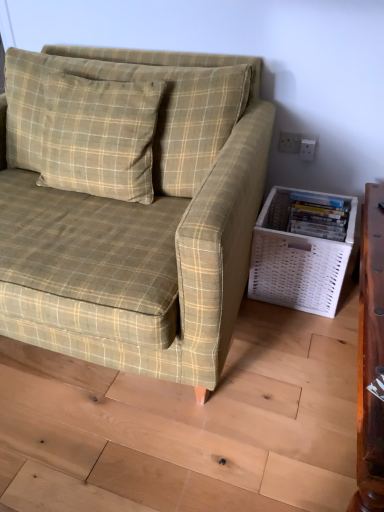
Question: Considering the relative sizes of white plastic electric outlet at upper right and green plaid pillow at upper left in the image provided, is white plastic electric outlet at upper right thinner than green plaid pillow at upper left?

Choices:
 (A) yes
 (B) no

Answer: (A)

Question: From a real-world perspective, does white plastic electric outlet at upper right stand above green plaid pillow at upper left?

Choices:
 (A) no
 (B) yes

Answer: (A)

Question: Is white plastic electric outlet at upper right to the right of green plaid pillow at upper left from the viewer's perspective?

Choices:
 (A) yes
 (B) no

Answer: (A)

Question: Is white plastic electric outlet at upper right positioned with its back to green plaid pillow at upper left?

Choices:
 (A) no
 (B) yes

Answer: (A)

Question: From a real-world perspective, does white plastic electric outlet at upper right sit lower than green plaid pillow at upper left?

Choices:
 (A) yes
 (B) no

Answer: (A)

Question: Considering the positions of white woven basket at lower right and green plaid pillow at upper left in the image, is white woven basket at lower right wider or thinner than green plaid pillow at upper left?

Choices:
 (A) wide
 (B) thin

Answer: (A)

Question: Is white woven basket at lower right situated inside green plaid pillow at upper left or outside?

Choices:
 (A) inside
 (B) outside

Answer: (B)

Question: From the image's perspective, is white woven basket at lower right positioned above or below green plaid pillow at upper left?

Choices:
 (A) above
 (B) below

Answer: (B)

Question: Considering the positions of point (324, 301) and point (140, 176), is point (324, 301) closer or farther from the camera than point (140, 176)?

Choices:
 (A) closer
 (B) farther

Answer: (B)

Question: Is white plastic electric outlet at upper right in front of or behind white woven basket at lower right in the image?

Choices:
 (A) front
 (B) behind

Answer: (B)

Question: Would you say white plastic electric outlet at upper right is inside or outside white woven basket at lower right?

Choices:
 (A) outside
 (B) inside

Answer: (A)

Question: Considering the positions of white plastic electric outlet at upper right and white woven basket at lower right in the image, is white plastic electric outlet at upper right taller or shorter than white woven basket at lower right?

Choices:
 (A) short
 (B) tall

Answer: (A)

Question: Looking at the image, does white plastic electric outlet at upper right seem bigger or smaller compared to white woven basket at lower right?

Choices:
 (A) big
 (B) small

Answer: (B)

Question: From a real-world perspective, is green plaid fabric couch at center physically located above or below white woven basket at lower right?

Choices:
 (A) above
 (B) below

Answer: (A)

Question: Visually, is green plaid fabric couch at center positioned to the left or to the right of white woven basket at lower right?

Choices:
 (A) right
 (B) left

Answer: (B)